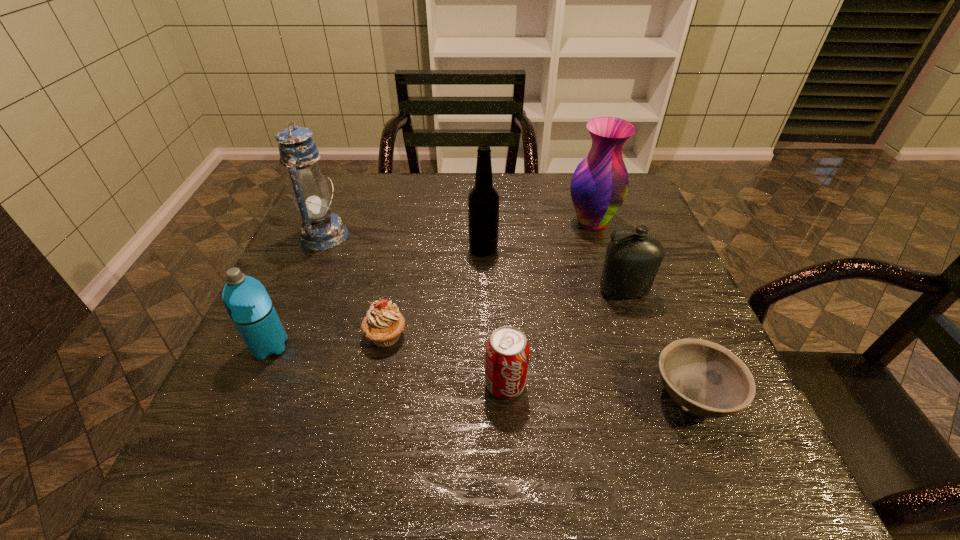
Find the location of a particular element. This screenshot has width=960, height=540. blank space at the near right corner of the desktop is located at coordinates (760, 454).

Find the location of a particular element. The width and height of the screenshot is (960, 540). vacant area that lies between the thermos bottle and the sixth object from right to left is located at coordinates (327, 341).

The width and height of the screenshot is (960, 540). Identify the location of empty location between the third shortest object and the vase. (548, 303).

Find the location of `free space between the soda and the beer bottle`. free space between the soda and the beer bottle is located at coordinates (494, 316).

You are a GUI agent. You are given a task and a screenshot of the screen. Output one action in this format:
    pyautogui.click(x=<x>, y=<y>)
    Task: Click on the empty location between the sixth tallest object and the thermos bottle
    
    Given the screenshot: What is the action you would take?
    pyautogui.click(x=388, y=366)

Locate an element on the screen. The image size is (960, 540). vacant point located between the lantern and the thermos bottle is located at coordinates (297, 291).

The width and height of the screenshot is (960, 540). I want to click on free space between the vase and the lantern, so click(458, 230).

Where is `vacant region between the third object from left to right and the soda`? Image resolution: width=960 pixels, height=540 pixels. vacant region between the third object from left to right and the soda is located at coordinates (445, 360).

I want to click on empty space between the thermos bottle and the beer bottle, so click(376, 298).

Find the location of a particular element. The image size is (960, 540). vacant space that is in between the lantern and the second shortest object is located at coordinates (354, 286).